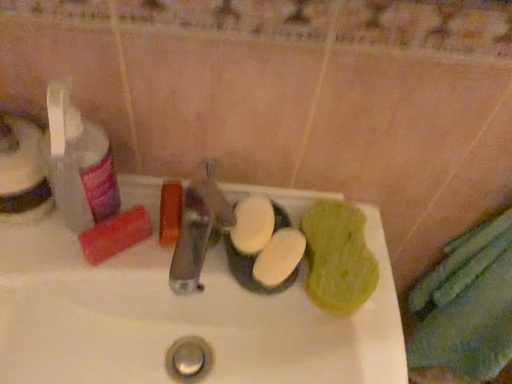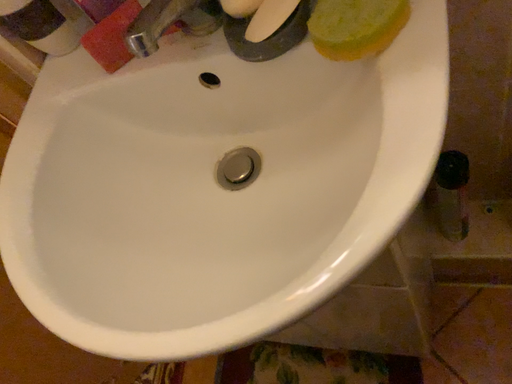
Question: How did the camera likely rotate when shooting the video?

Choices:
 (A) rotated right
 (B) rotated left

Answer: (B)